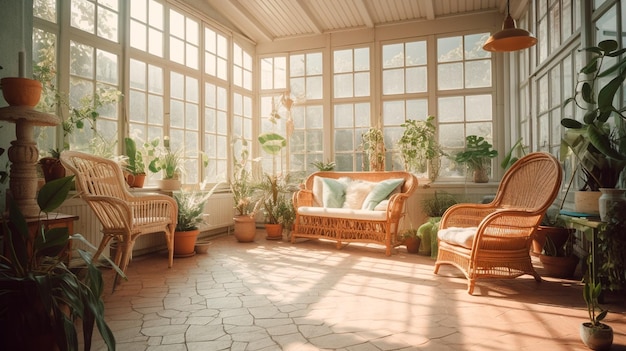
Identify the location of area rugs not in image. The width and height of the screenshot is (626, 351). (424, 290), (320, 256), (151, 275), (282, 316).